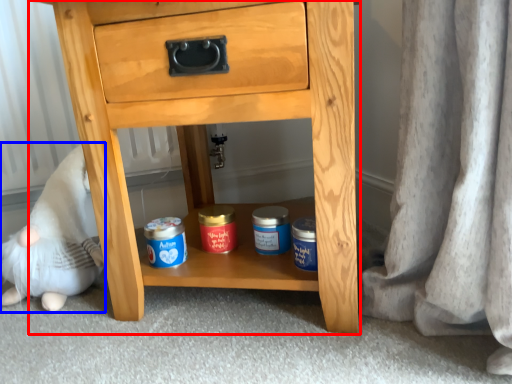
Question: Among these objects, which one is nearest to the camera, chest of drawers (highlighted by a red box) or toy (highlighted by a blue box)?

Choices:
 (A) chest of drawers
 (B) toy

Answer: (A)